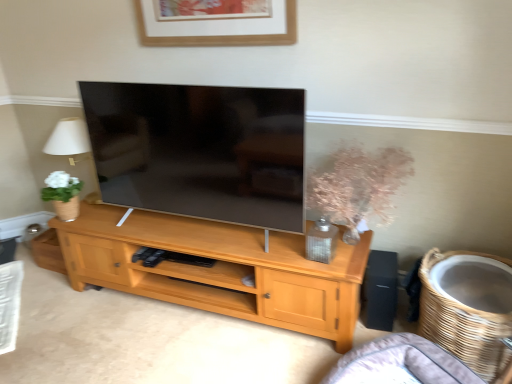
Question: From a real-world perspective, is gray fabric couch at lower right positioned over wooden picture frame at upper center based on gravity?

Choices:
 (A) yes
 (B) no

Answer: (B)

Question: Is there a large distance between gray fabric couch at lower right and wooden picture frame at upper center?

Choices:
 (A) no
 (B) yes

Answer: (B)

Question: Is gray fabric couch at lower right shorter than wooden picture frame at upper center?

Choices:
 (A) no
 (B) yes

Answer: (B)

Question: Is gray fabric couch at lower right outside of wooden picture frame at upper center?

Choices:
 (A) no
 (B) yes

Answer: (B)

Question: Is gray fabric couch at lower right smaller than wooden picture frame at upper center?

Choices:
 (A) no
 (B) yes

Answer: (A)

Question: Does gray fabric couch at lower right have a greater width compared to wooden picture frame at upper center?

Choices:
 (A) yes
 (B) no

Answer: (A)

Question: Considering the relative positions of translucent glass vase at center-right and woven brown basket at lower right in the image provided, is translucent glass vase at center-right in front of woven brown basket at lower right?

Choices:
 (A) no
 (B) yes

Answer: (A)

Question: Is translucent glass vase at center-right turned away from woven brown basket at lower right?

Choices:
 (A) no
 (B) yes

Answer: (A)

Question: Can we say translucent glass vase at center-right lies outside woven brown basket at lower right?

Choices:
 (A) no
 (B) yes

Answer: (B)

Question: Can you confirm if translucent glass vase at center-right is taller than woven brown basket at lower right?

Choices:
 (A) yes
 (B) no

Answer: (B)

Question: From the image's perspective, does translucent glass vase at center-right appear lower than woven brown basket at lower right?

Choices:
 (A) no
 (B) yes

Answer: (A)

Question: Is translucent glass vase at center-right wider than woven brown basket at lower right?

Choices:
 (A) no
 (B) yes

Answer: (A)

Question: Are light wood cabinet at center and translucent glass vase at center-right beside each other?

Choices:
 (A) yes
 (B) no

Answer: (B)